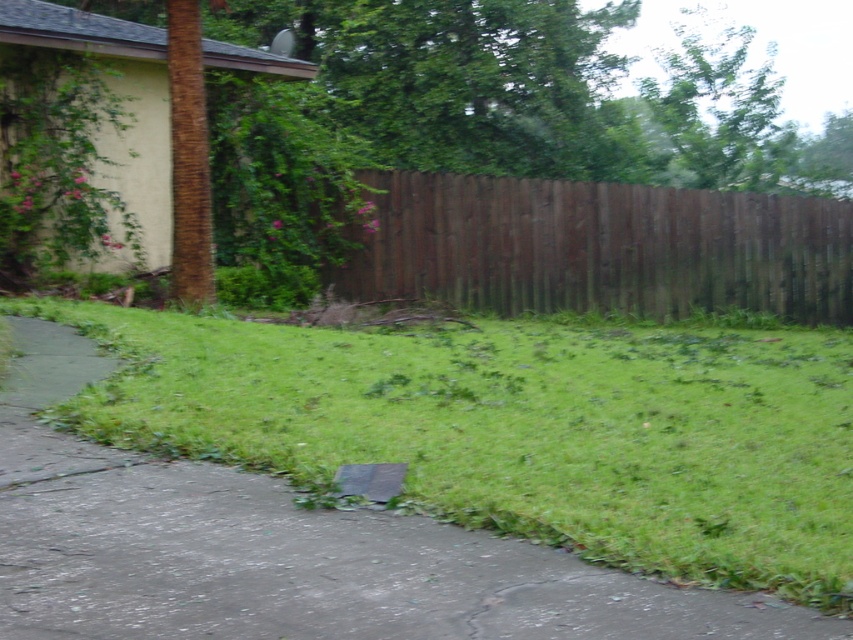
Question: Does green grass at lower left appear over brown wood fence at center?

Choices:
 (A) no
 (B) yes

Answer: (A)

Question: Which of the following is the farthest from the observer?

Choices:
 (A) green grass at lower left
 (B) brown wood fence at center

Answer: (B)

Question: Is green grass at lower left above brown wood fence at center?

Choices:
 (A) yes
 (B) no

Answer: (B)

Question: Is green grass at lower left wider than brown wood fence at center?

Choices:
 (A) yes
 (B) no

Answer: (B)

Question: Which point is closer to the camera taking this photo?

Choices:
 (A) (316, 337)
 (B) (387, 180)

Answer: (A)